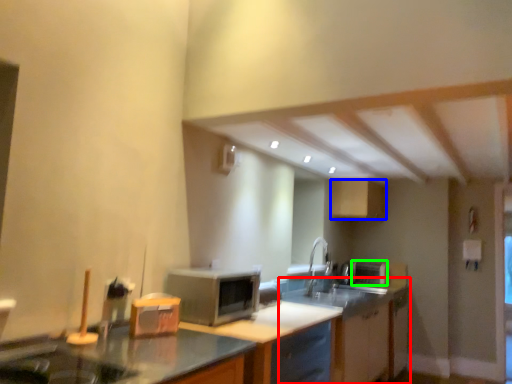
Question: Which object is positioned farthest from cabinetry (highlighted by a red box)? Select from cabinetry (highlighted by a blue box) and appliance (highlighted by a green box).

Choices:
 (A) cabinetry
 (B) appliance

Answer: (A)